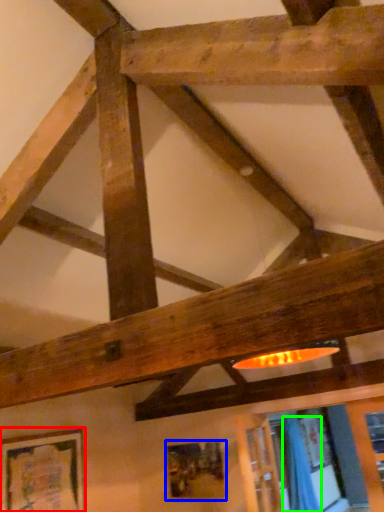
Question: Which object is the farthest from picture frame (highlighted by a red box)? Choose among these: picture frame (highlighted by a blue box) or curtain (highlighted by a green box).

Choices:
 (A) picture frame
 (B) curtain

Answer: (B)